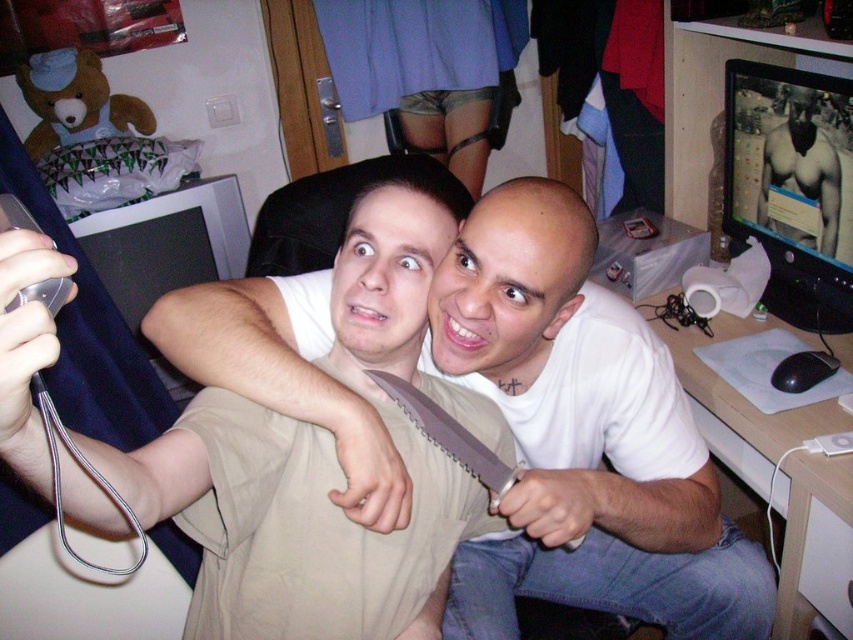
What do you see at coordinates (583, 436) in the screenshot?
I see `white matte shirt at center` at bounding box center [583, 436].

Can you confirm if white matte shirt at center is taller than matte black monitor at upper right?

Indeed, white matte shirt at center has a greater height compared to matte black monitor at upper right.

Does point (514, 499) come behind point (788, 140)?

No, (514, 499) is in front of (788, 140).

Locate an element on the screen. white matte shirt at center is located at coordinates (583, 436).

Who is taller, white matte shirt at center or beige fabric knife at upper center?

white matte shirt at center is taller.

Can you confirm if white matte shirt at center is positioned to the right of beige fabric knife at upper center?

Yes, white matte shirt at center is to the right of beige fabric knife at upper center.

The height and width of the screenshot is (640, 853). What are the coordinates of `white matte shirt at center` in the screenshot? It's located at (583, 436).

Is matte black monitor at upper right smaller than black matte monitor at left?

Indeed, matte black monitor at upper right has a smaller size compared to black matte monitor at left.

Does matte black monitor at upper right have a larger size compared to black matte monitor at left?

No.

Describe the element at coordinates (792, 186) in the screenshot. The height and width of the screenshot is (640, 853). I see `matte black monitor at upper right` at that location.

I want to click on matte black monitor at upper right, so click(792, 186).